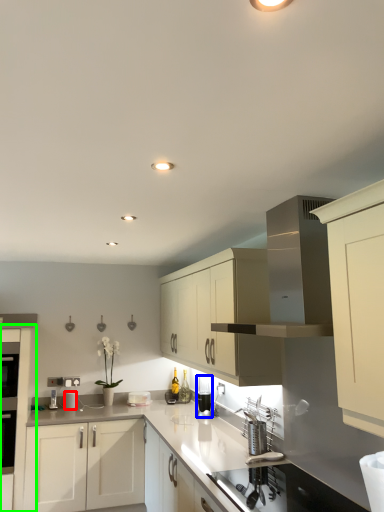
Question: Which is farther away from appliance (highlighted by a red box)? appliance (highlighted by a blue box) or cabinetry (highlighted by a green box)?

Choices:
 (A) appliance
 (B) cabinetry

Answer: (A)